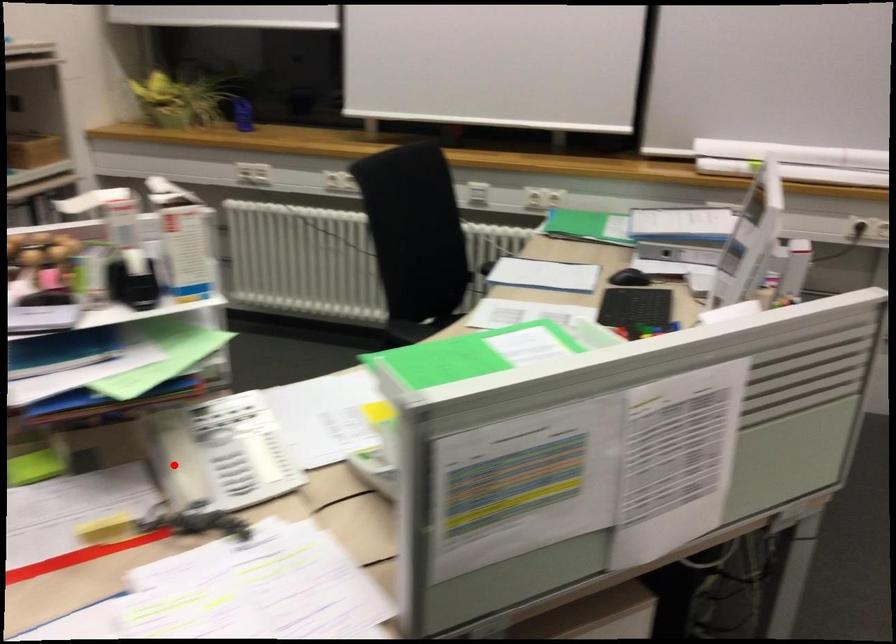
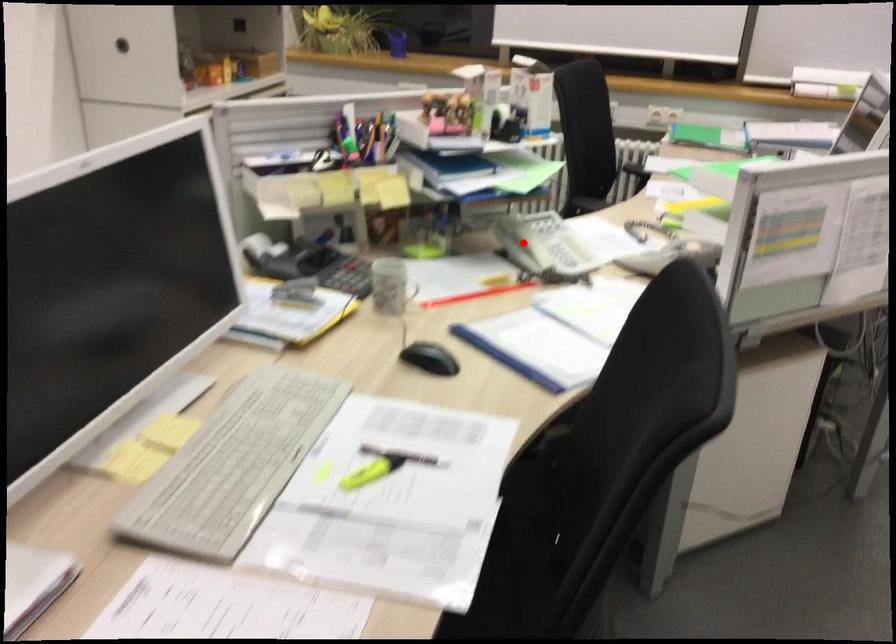
I am providing you with two images of the same scene from different viewpoints. A red point is marked on the first image and another point is marked on the second image. Are the points marked in image1 and image2 representing the same 3D position?

Yes